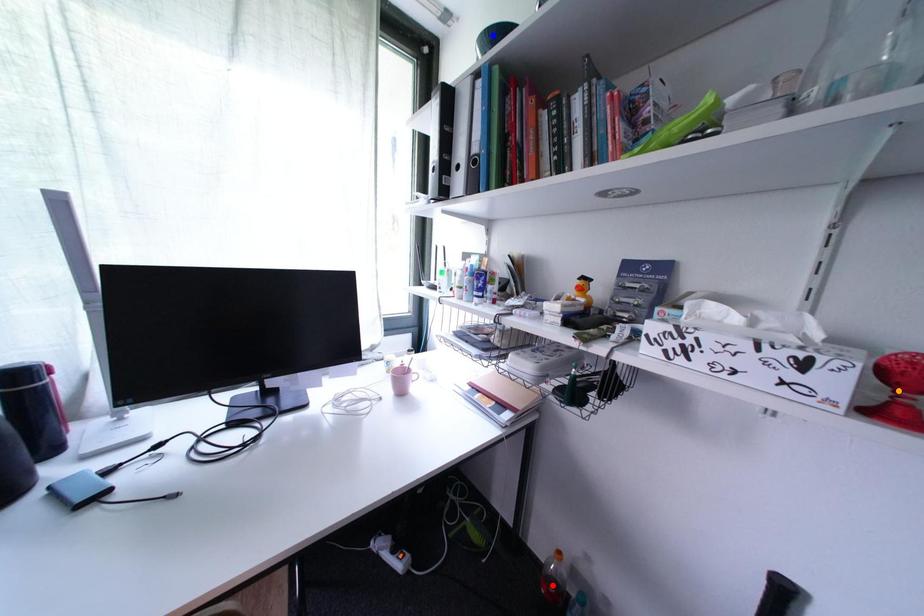
Order these from nearest to farthest:
A) orange point
B) blue point
C) red point

orange point
blue point
red point